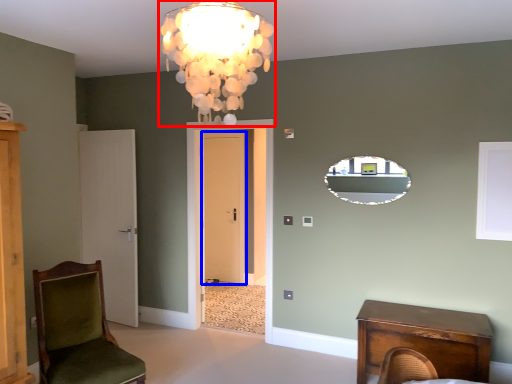
Question: Which of the following is the farthest to the observer, lamp (highlighted by a red box) or door (highlighted by a blue box)?

Choices:
 (A) lamp
 (B) door

Answer: (B)